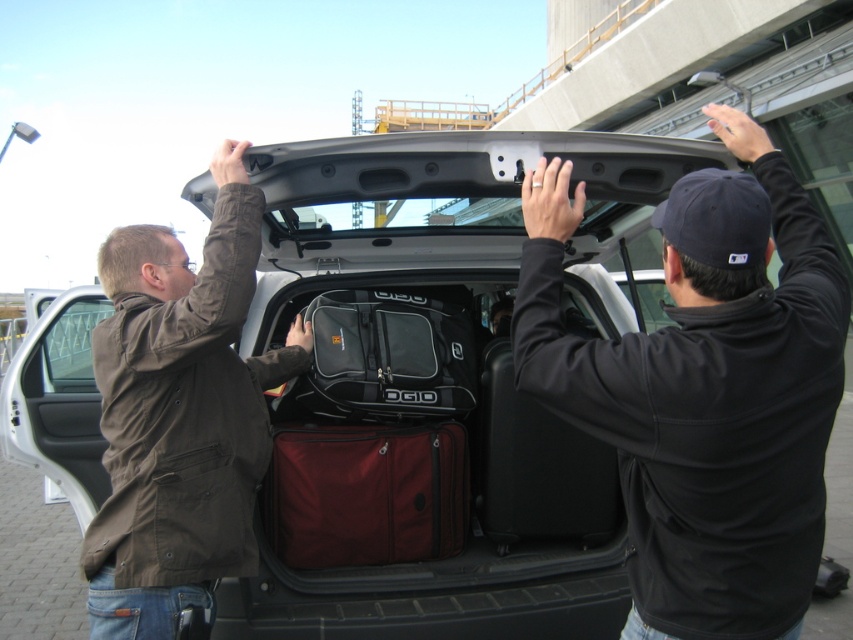
How much distance is there between black matte luggage at center and brown fabric jacket at center?

black matte luggage at center and brown fabric jacket at center are 17.50 inches apart.

Which is in front, point (351, 410) or point (254, 403)?

Point (254, 403) is more forward.

Is point (506, 476) farther from viewer compared to point (239, 202)?

That is True.

This screenshot has height=640, width=853. I want to click on black matte luggage at center, so click(433, 392).

Does brown fabric jacket at center lie in front of matte red suitcase at center?

Yes.

This screenshot has width=853, height=640. Describe the element at coordinates (180, 413) in the screenshot. I see `brown fabric jacket at center` at that location.

Image resolution: width=853 pixels, height=640 pixels. What are the coordinates of `brown fabric jacket at center` in the screenshot? It's located at [180, 413].

Between black matte luggage at center and black matte suitcase at center, which one appears on the right side from the viewer's perspective?

From the viewer's perspective, black matte luggage at center appears more on the right side.

Is black matte luggage at center taller than black matte suitcase at center?

Correct, black matte luggage at center is much taller as black matte suitcase at center.

Between point (416, 150) and point (524, 515), which one is positioned behind?

The point (524, 515) is more distant.

Where is `black matte luggage at center`? The height and width of the screenshot is (640, 853). black matte luggage at center is located at coordinates (433, 392).